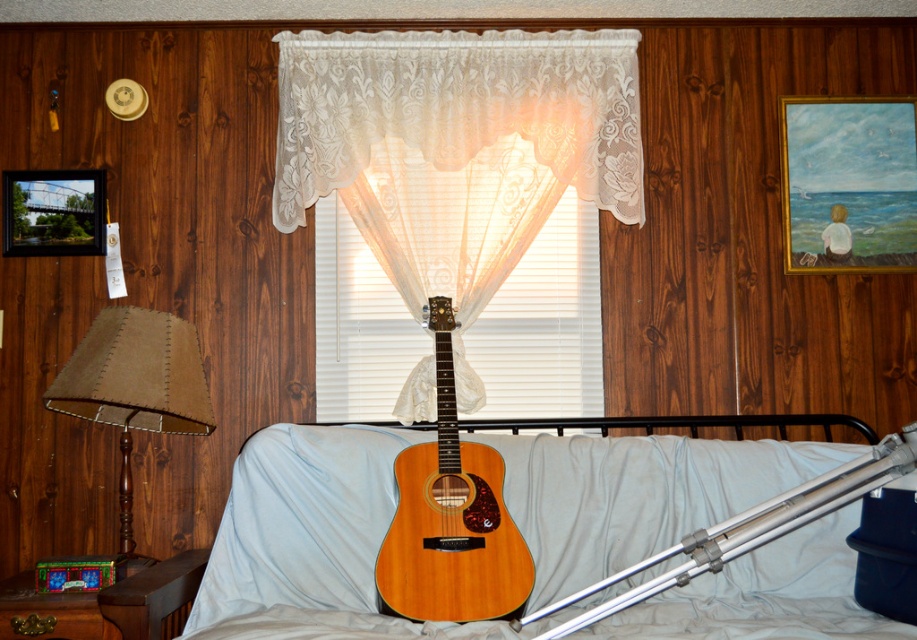
Between point (639, 636) and point (384, 593), which one is positioned behind?

Point (384, 593)

What do you see at coordinates (304, 534) in the screenshot?
I see `wooden bed at center` at bounding box center [304, 534].

I want to click on wooden bed at center, so click(304, 534).

Locate an element on the screen. wooden bed at center is located at coordinates (304, 534).

Is wooden bed at center wider than wooden framed painting of child at upper right?

Yes.

Is point (644, 467) more distant than point (794, 147)?

That is False.

Does point (377, 540) come farther from viewer compared to point (815, 237)?

No, it is in front of (815, 237).

You are a GUI agent. You are given a task and a screenshot of the screen. Output one action in this format:
    pyautogui.click(x=<x>, y=<y>)
    Task: Click on the wooden bed at center
    This screenshot has width=917, height=640.
    Given the screenshot: What is the action you would take?
    pyautogui.click(x=304, y=534)

Does point (457, 129) lie in front of point (191, 419)?

No, it is not.

Is white lace curtain at center shorter than brown fabric lampshade at left?

In fact, white lace curtain at center may be taller than brown fabric lampshade at left.

Between point (396, 141) and point (59, 401), which one is positioned in front?

Point (59, 401) is in front.

Image resolution: width=917 pixels, height=640 pixels. Find the location of `white lace curtain at center`. white lace curtain at center is located at coordinates (456, 148).